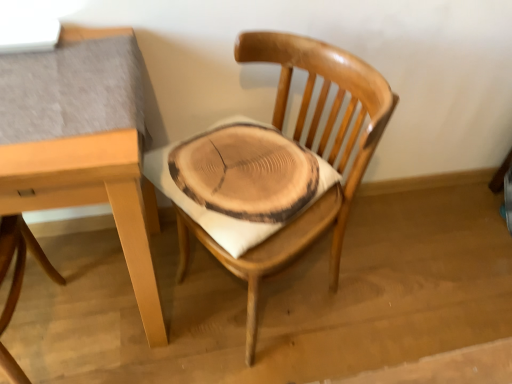
This screenshot has width=512, height=384. I want to click on vacant area on top of light brown wood table at upper left (from a real-world perspective), so click(x=54, y=79).